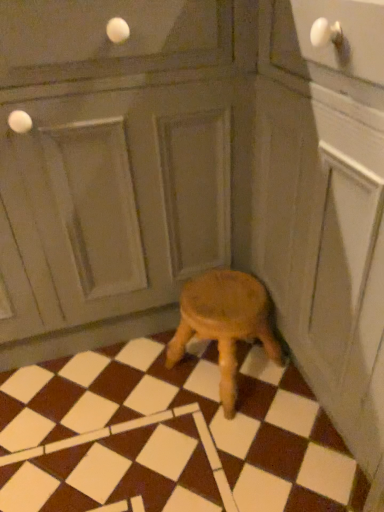
Question: Is brown matte tile at center positioned in front of matte gray screen door at center?

Choices:
 (A) no
 (B) yes

Answer: (A)

Question: Would you say brown matte tile at center is outside matte gray screen door at center?

Choices:
 (A) yes
 (B) no

Answer: (A)

Question: Would you consider brown matte tile at center to be distant from matte gray screen door at center?

Choices:
 (A) yes
 (B) no

Answer: (B)

Question: Does brown matte tile at center have a smaller size compared to matte gray screen door at center?

Choices:
 (A) no
 (B) yes

Answer: (B)

Question: Is brown matte tile at center oriented towards matte gray screen door at center?

Choices:
 (A) no
 (B) yes

Answer: (A)

Question: Does brown matte tile at center have a lesser width compared to matte gray screen door at center?

Choices:
 (A) yes
 (B) no

Answer: (B)

Question: Is wooden stool at center not near brown matte tile at center?

Choices:
 (A) yes
 (B) no

Answer: (B)

Question: Would you say brown matte tile at center is part of wooden stool at center's contents?

Choices:
 (A) no
 (B) yes

Answer: (A)

Question: From the image's perspective, is wooden stool at center under brown matte tile at center?

Choices:
 (A) yes
 (B) no

Answer: (A)

Question: Considering the relative sizes of wooden stool at center and brown matte tile at center in the image provided, is wooden stool at center wider than brown matte tile at center?

Choices:
 (A) yes
 (B) no

Answer: (B)

Question: Considering the relative sizes of wooden stool at center and brown matte tile at center in the image provided, is wooden stool at center bigger than brown matte tile at center?

Choices:
 (A) yes
 (B) no

Answer: (B)

Question: Is wooden stool at center not within brown matte tile at center?

Choices:
 (A) yes
 (B) no

Answer: (A)

Question: Is matte gray screen door at center positioned beyond the bounds of wooden stool at center?

Choices:
 (A) no
 (B) yes

Answer: (B)